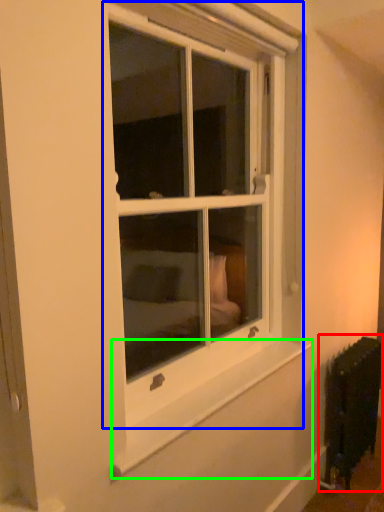
Question: Which object is positioned farthest from radiator (highlighted by a red box)? Select from window (highlighted by a blue box) and window sill (highlighted by a green box).

Choices:
 (A) window
 (B) window sill

Answer: (A)